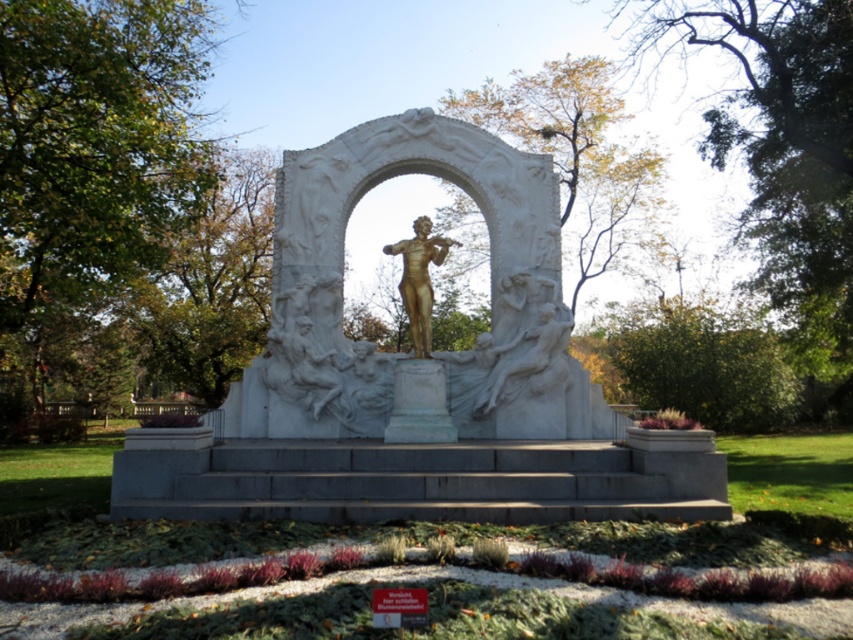
You are standing at the bottom of the monument steps. You want to take a photo of both the white marble statue at center and the gold statue at center in the same frame. Which statue should you position closer to the camera to include both in the photo?

You should position the white marble statue at center closer to the camera because it is in front of the gold statue at center, allowing both to be captured in the same frame when focused on the foreground statue.

You are standing at the entrance of the park and want to take a photo of the white marble statue at center. According to the image, where should you position yourself to capture the statue in the frame?

The white marble statue at center is located at point coordinates of (438, 352), so you should position yourself directly in front of the monument to ensure the statue is centered in your photo.

You are an architect designing a new pathway around the monument. You need to ensure that the pathway maintains a minimum distance of 10 meters between the two gold statues mentioned. Can the existing placement of the gold statue at center and the gold polished statue at center support this requirement?

The gold statue at center is 11.69 meters from the gold polished statue at center. Since 11.69 meters exceeds the minimum required distance of 10 meters, the existing placement supports the requirement.